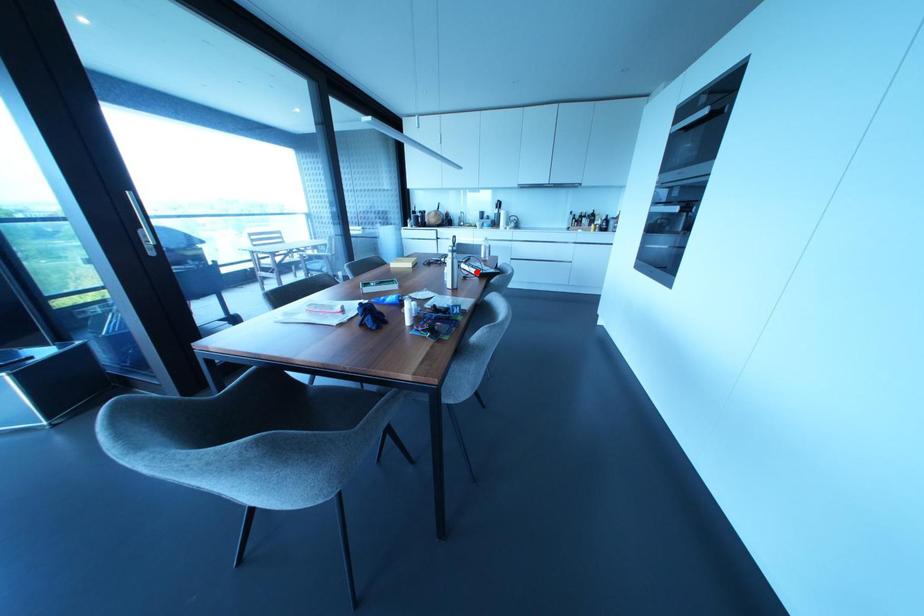
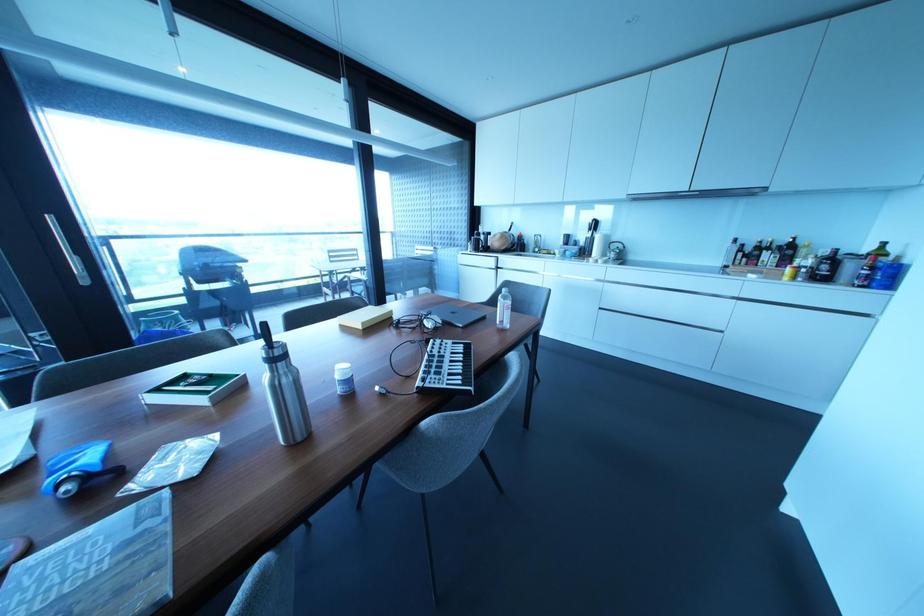
The point at the highlighted location is marked in the first image. Where is the corresponding point in the second image?

(418, 382)